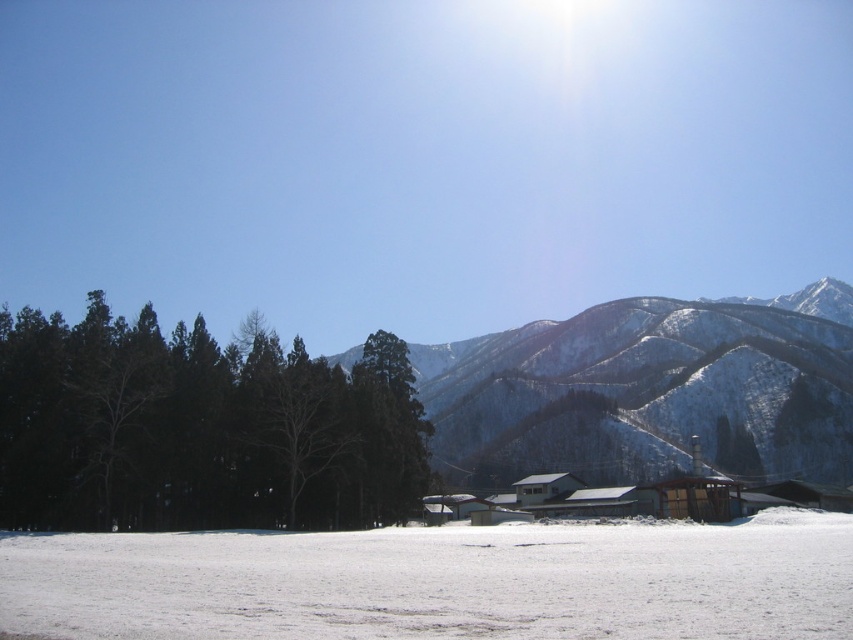
You are a photographer planning to capture a landscape shot of the winter scene. You want to include both the green matte trees at left and the green matte tree at center in your frame. If your camera has a field of view that can capture objects up to 10 meters apart, will you be able to fit both trees in the same photo?

The green matte trees at left and green matte tree at center are 8.77 meters apart from each other, which is within the camera field of view of 10 meters. Therefore, you can fit both trees in the same photo.

You are standing at the edge of the snow in this winter scene. You want to walk towards the green matte trees at left. Will you have to climb over or go around the white snow at lower center?

The white snow at lower center is located below green matte trees at left, so you would need to walk over the white snow at lower center to reach the green matte trees at left.

You are standing at the center of the snow covered ground in the foreground of the winter landscape. You see a point marked at coordinates (200, 428). What object is located at that point?

The point at coordinates (200, 428) corresponds to green matte trees at left.